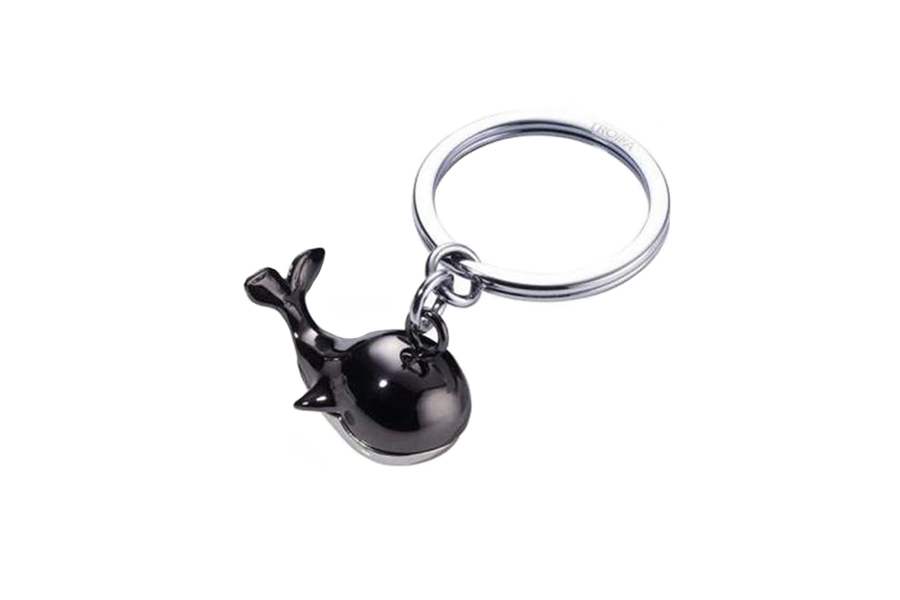
I want to click on light reflection on whale pendant surface, so click(390, 347), click(441, 405), click(385, 384), click(310, 337), click(342, 342), click(293, 334).